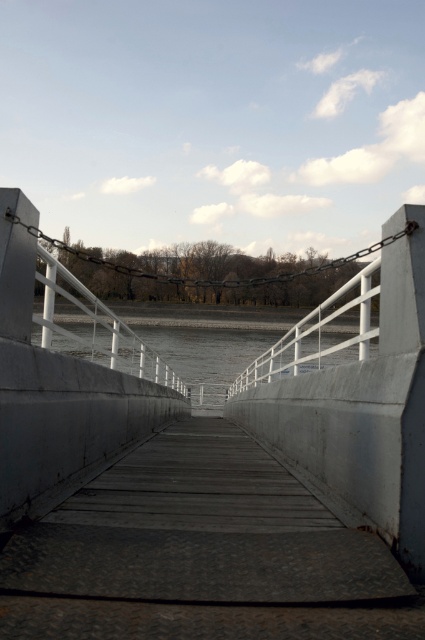
Is smooth concrete bridge at center bigger than gray concrete river at center?

No.

Between smooth concrete bridge at center and gray concrete river at center, which one has more height?

With more height is gray concrete river at center.

Is point (161, 465) more distant than point (371, 326)?

Yes, it is.

Locate an element on the screen. The image size is (425, 640). smooth concrete bridge at center is located at coordinates (209, 476).